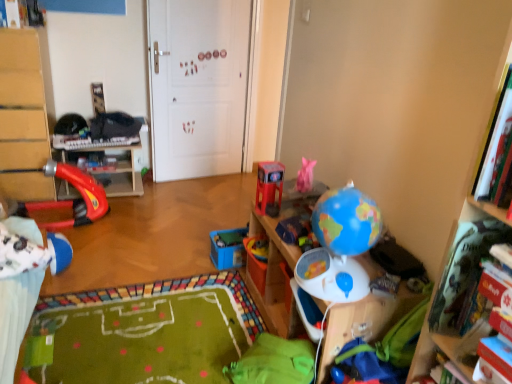
At what (x,y) coordinates should I click in order to perform the action: click on free point above blue rubber ball at lower right, arranged as the 7th toy when viewed from the left (from a real-world perspective). Please return your answer as a coordinate pair (x, y). The height and width of the screenshot is (384, 512). Looking at the image, I should click on (382, 352).